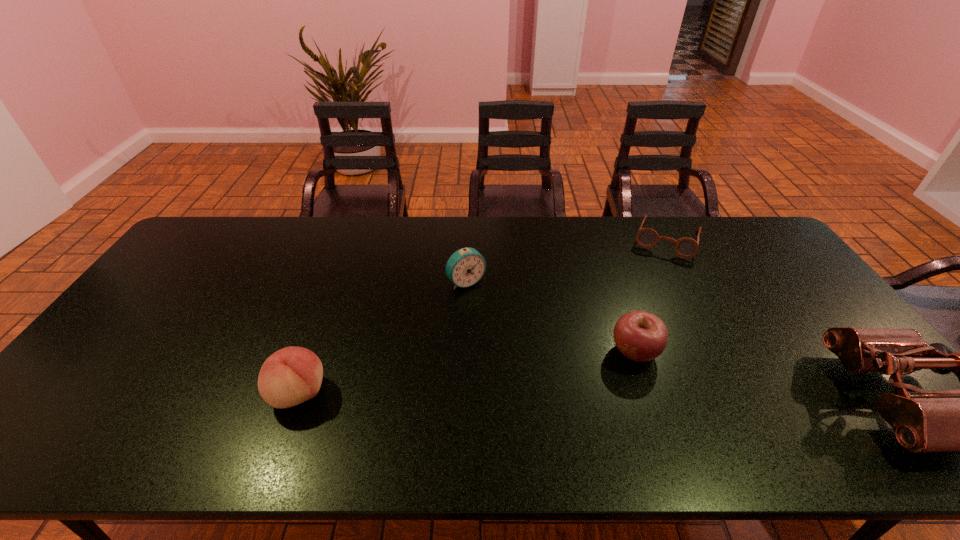
The width and height of the screenshot is (960, 540). Identify the location of the leftmost object. (290, 376).

Find the location of a particular element. The width and height of the screenshot is (960, 540). the second farthest object is located at coordinates 465,267.

Locate an element on the screen. alarm clock is located at coordinates (465, 267).

This screenshot has width=960, height=540. In order to click on the third object from left to right in this screenshot , I will do `click(640, 336)`.

Locate an element on the screen. The image size is (960, 540). the shortest object is located at coordinates (685, 247).

I want to click on the second object from right to left, so click(685, 247).

This screenshot has width=960, height=540. Identify the location of free space located on the back of the peach. (313, 354).

The width and height of the screenshot is (960, 540). Find the location of `free space located on the front-facing side of the second farthest object`. free space located on the front-facing side of the second farthest object is located at coordinates (496, 317).

Identify the location of vacant space located on the front-facing side of the second farthest object. Image resolution: width=960 pixels, height=540 pixels. (486, 304).

In order to click on blank space located 0.310m on the front-facing side of the second farthest object in this screenshot , I will do `click(534, 363)`.